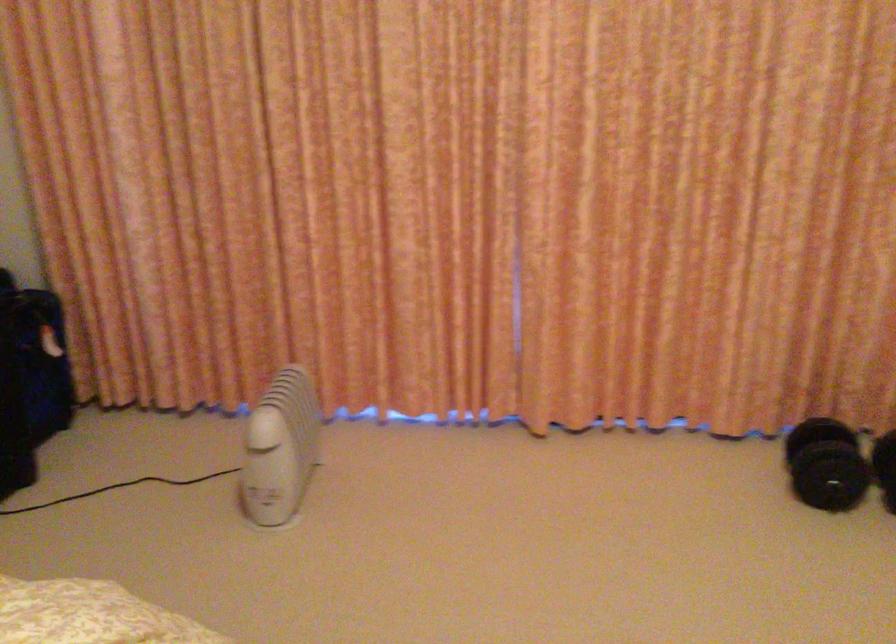
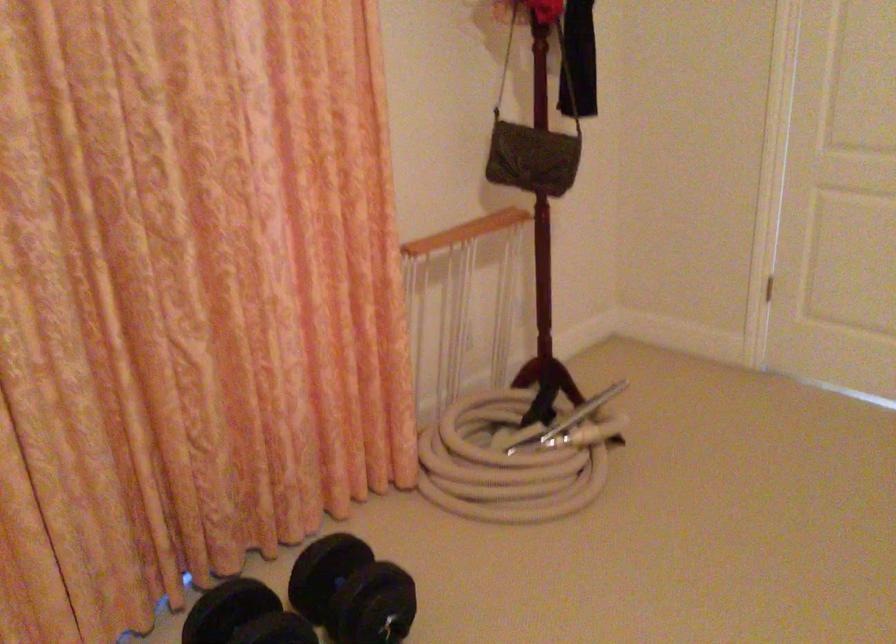
Question: The camera is either moving clockwise (left) or counter-clockwise (right) around the object. The first image is from the beginning of the video and the second image is from the end. Is the camera moving left or right when shooting the video?

Choices:
 (A) Left
 (B) Right

Answer: (A)